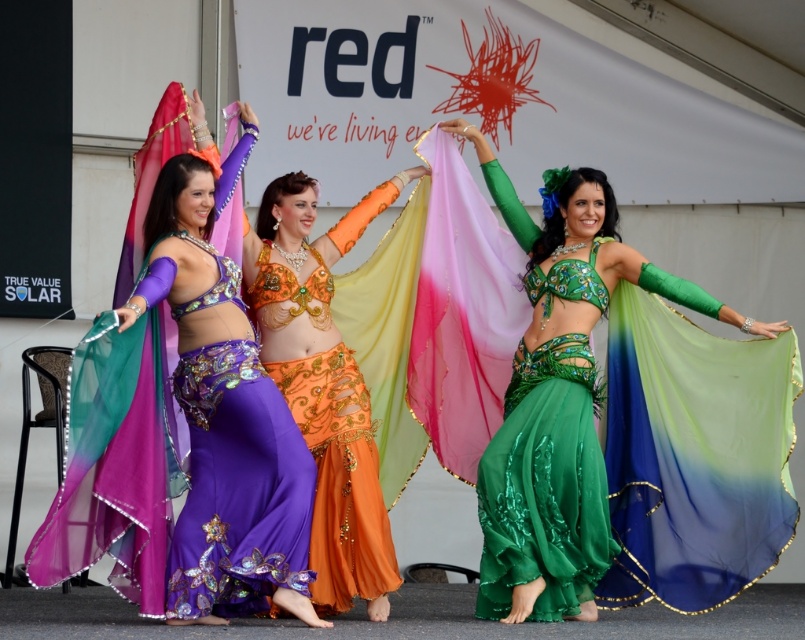
Is green satin belly dancer at center below green satin dress at center?

Incorrect, green satin belly dancer at center is not positioned below green satin dress at center.

Between point (614, 388) and point (581, 410), which one is positioned in front?

Positioned in front is point (581, 410).

Describe the element at coordinates (671, 410) in the screenshot. I see `green satin belly dancer at center` at that location.

The image size is (805, 640). What are the coordinates of `green satin belly dancer at center` in the screenshot? It's located at (671, 410).

Which is more to the left, purple satin belly dancer at center or green satin dress at center?

purple satin belly dancer at center is more to the left.

Is point (226, 179) more distant than point (585, 412)?

No.

What do you see at coordinates (223, 412) in the screenshot? Image resolution: width=805 pixels, height=640 pixels. I see `purple satin belly dancer at center` at bounding box center [223, 412].

Locate an element on the screen. This screenshot has height=640, width=805. purple satin belly dancer at center is located at coordinates (223, 412).

Which of these two, purple satin belly dancer at center or orange satin skirt at center, stands taller?

With more height is purple satin belly dancer at center.

Is purple satin belly dancer at center positioned in front of orange satin skirt at center?

Yes, it is in front of orange satin skirt at center.

This screenshot has height=640, width=805. What do you see at coordinates (223, 412) in the screenshot?
I see `purple satin belly dancer at center` at bounding box center [223, 412].

Locate an element on the screen. The width and height of the screenshot is (805, 640). purple satin belly dancer at center is located at coordinates [x=223, y=412].